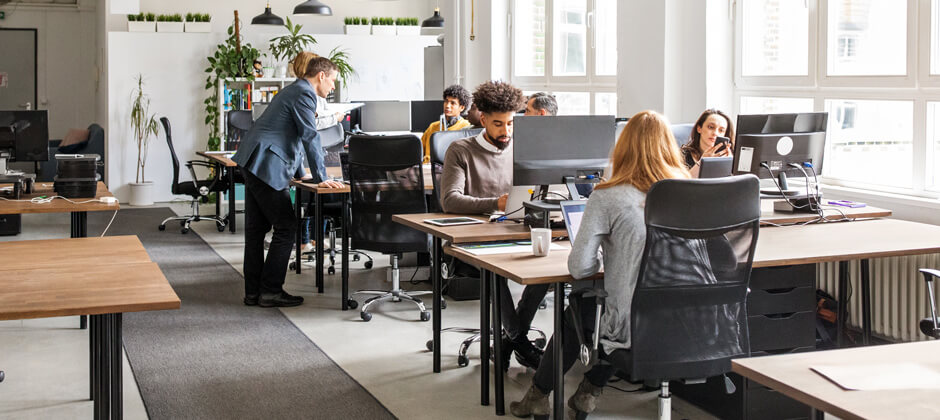
Image resolution: width=940 pixels, height=420 pixels. What are the coordinates of `computer chairs` in the screenshot? It's located at coord(676,285), coord(395,152), coord(435,143), coord(332,136), coord(240,124), coord(174,155), coord(682,131).